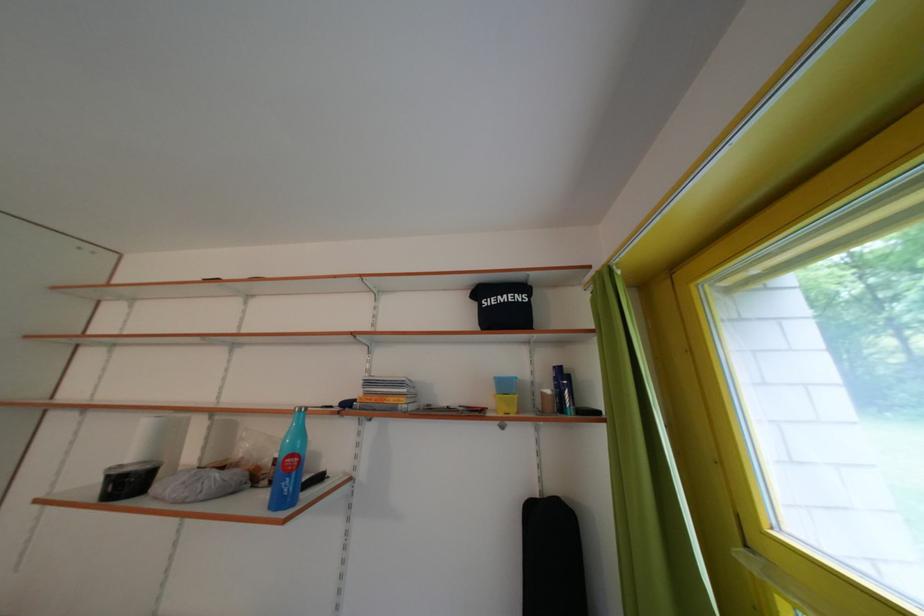
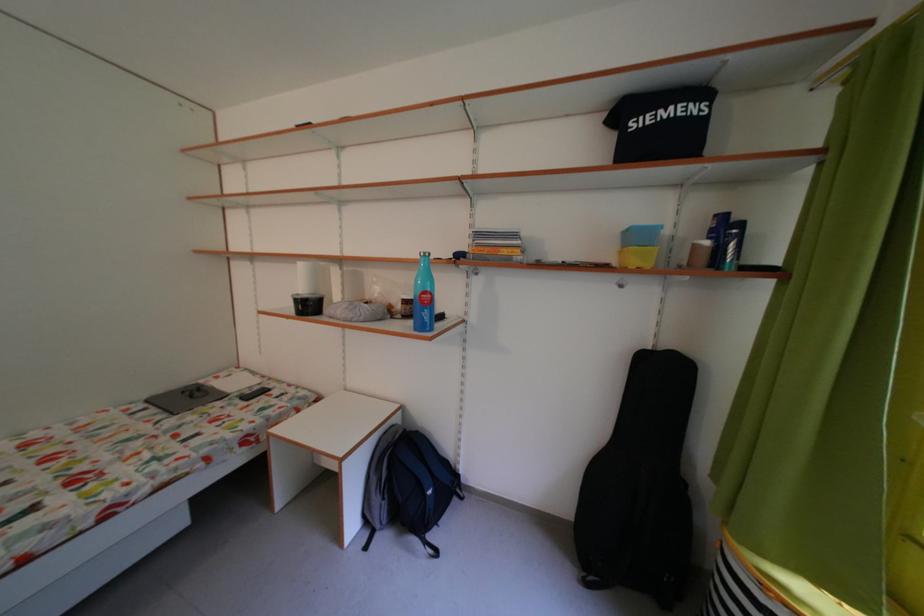
The point at (x=546, y=501) is marked in the first image. Where is the corresponding point in the second image?

(661, 354)